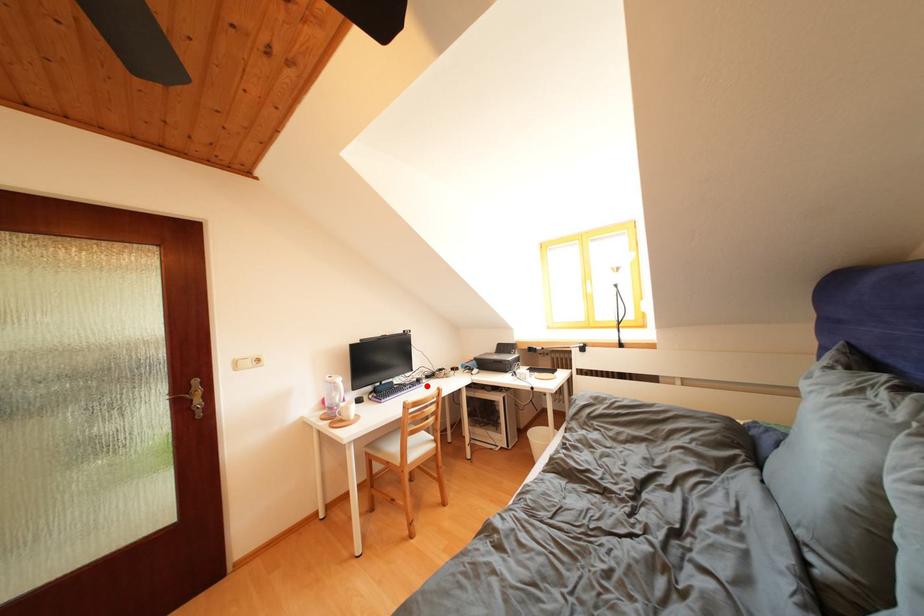
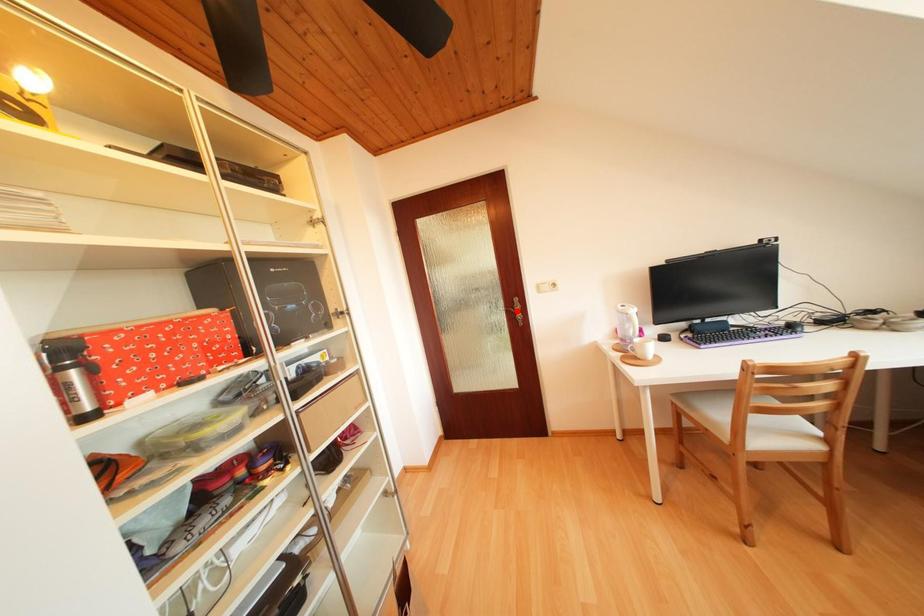
I am providing you with two images of the same scene from different viewpoints. A red point is marked on the first image and another point is marked on the second image. Does the point marked in image1 correspond to the same location as the one in image2?

No